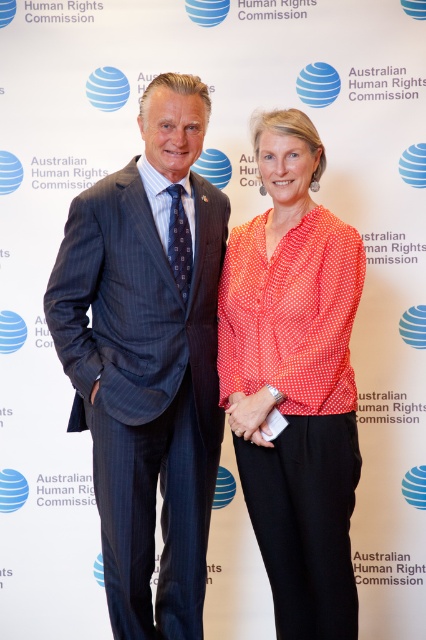
Question: Which object appears closest to the camera in this image?

Choices:
 (A) matte red blouse at center
 (B) dark blue pinstripe suit at center

Answer: (B)

Question: Can you confirm if dark blue pinstripe suit at center is wider than polka dot blouse at center?

Choices:
 (A) yes
 (B) no

Answer: (A)

Question: Estimate the real-world distances between objects in this image. Which object is closer to the matte red blouse at center?

Choices:
 (A) polka dot blouse at center
 (B) dark blue pinstripe suit at center

Answer: (A)

Question: Which of the following is the closest to the observer?

Choices:
 (A) dark blue pinstripe suit at center
 (B) polka dot blouse at center
 (C) matte red blouse at center

Answer: (A)

Question: Can you confirm if polka dot blouse at center is wider than matte red blouse at center?

Choices:
 (A) no
 (B) yes

Answer: (B)

Question: Can you confirm if polka dot blouse at center is positioned to the right of matte red blouse at center?

Choices:
 (A) yes
 (B) no

Answer: (A)